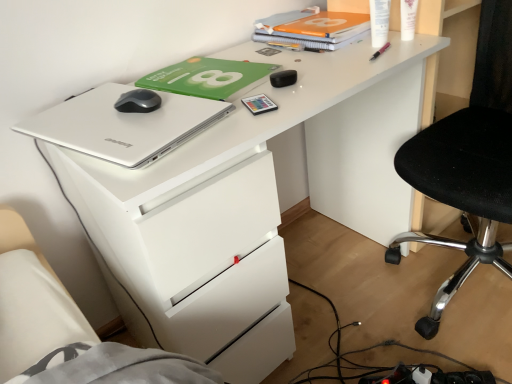
Image resolution: width=512 pixels, height=384 pixels. In order to click on free space behind black matte earbuds at center, acting as the second stationery starting from the left in this screenshot , I will do `click(274, 60)`.